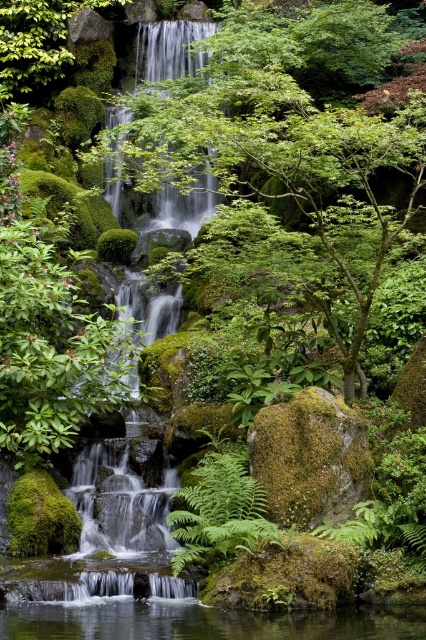
You are a hiker who wants to cross the waterfall area. You see the clear water at center and the green leafy fern at center. Which object is higher, making it easier to step on?

The clear water at center is taller than the green leafy fern at center, so you can step onto the clear water at center first as it is higher.

You are a hiker who wants to collect water from the clear water at center. The green mossy waterfall at upper center is flowing. Where should you place your water bottle to collect the water?

You should place your water bottle below the green mossy waterfall at upper center, where the clear water at center is located, to collect the water.

You are standing at the edge of the waterfall and want to reach the green leafy fern at center. Which direction should you move to get closer to it without stepping into the clear water at center?

You should move sideways away from the clear water at center to reach the green leafy fern at center because the clear water at center is closer to you than the fern, so moving sideways around the water will allow you to access the fern without entering the water.